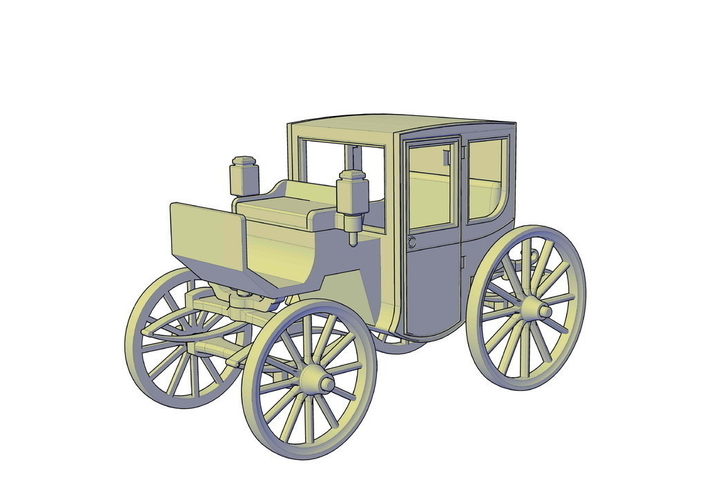
At what (x,y) coordinates should I click in order to perform the action: click on door. Please return your answer as a coordinate pair (x, y). Looking at the image, I should click on (423, 255).